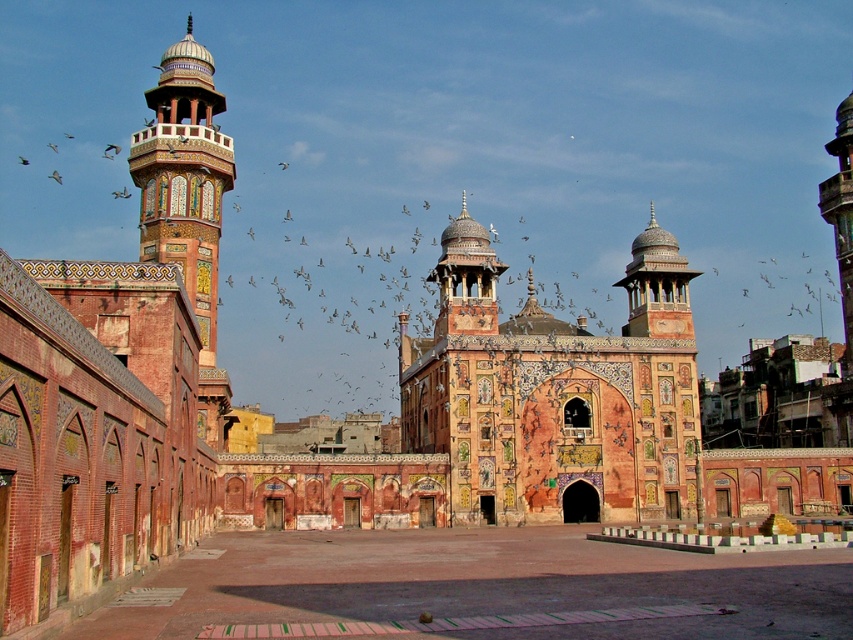
Which of these two, terracotta mosaic palace at center or decorative mosaic minaret at left, stands taller?

decorative mosaic minaret at left is taller.

Is terracotta mosaic palace at center taller than decorative mosaic minaret at left?

No.

Between point (508, 349) and point (196, 200), which one is positioned in front?

Point (508, 349)

The height and width of the screenshot is (640, 853). What are the coordinates of `terracotta mosaic palace at center` in the screenshot? It's located at (555, 392).